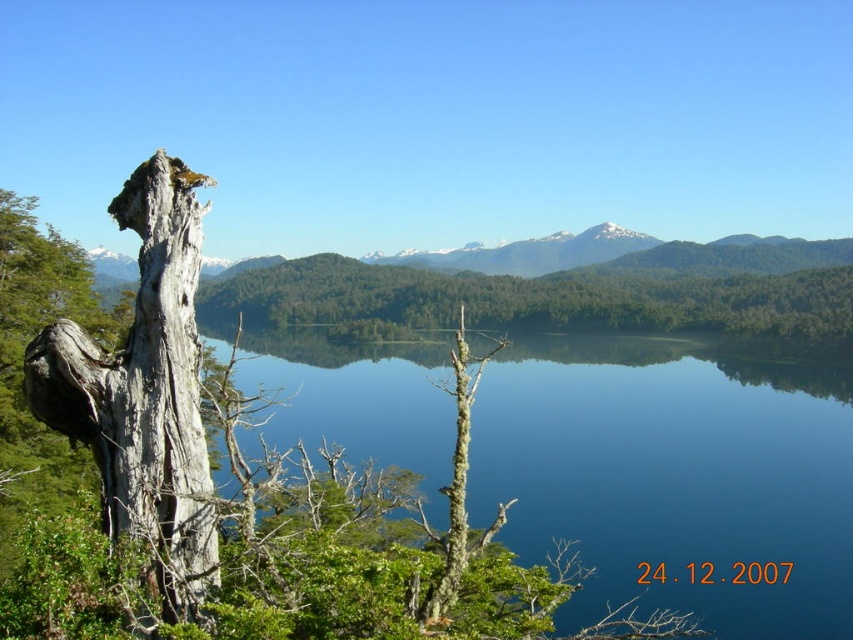
You are a photographer wanting to capture the reflection of the gray rough bark tree at left in the blue glassy water at center. Can you see the tree reflected in the water?

The gray rough bark tree at left is positioned over blue glassy water at center, so its reflection would be visible in the water since the water surface is calm and reflective.

You are standing at the edge of the lake and see the blue glassy water at center and the gray rough bark tree trunk at left. Which object is closer to the water surface?

The blue glassy water at center is located below the gray rough bark tree trunk at left, so the blue glassy water at center is closer to the water surface.

You are an artist sketching the landscape and want to ensure the proportions are accurate. Which object should you draw taller between the gray rough bark tree at left and the gray rough bark tree trunk at left?

The gray rough bark tree at left should be drawn taller than the gray rough bark tree trunk at left because the description states that the gray rough bark tree at left has a greater height compared to the gray rough bark tree trunk at left.